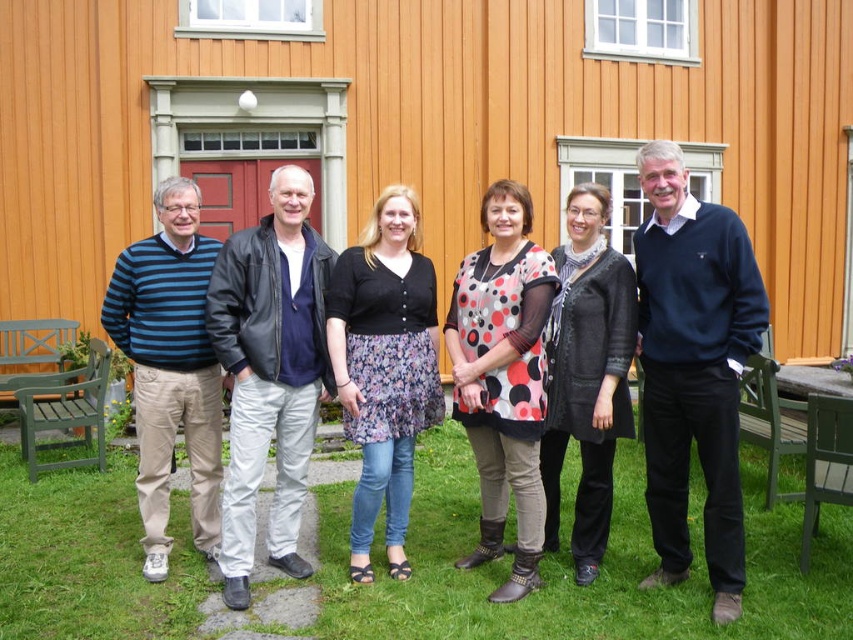
You are standing in front of the wooden building and want to take a photo that includes both the point at location [730,445] and the point at [165,577]. Which point should you focus on first to ensure both are in sharp focus?

You should focus on the point at [730,445] first because it is closer to the camera than the point at [165,577], ensuring both points are within the depth of field.